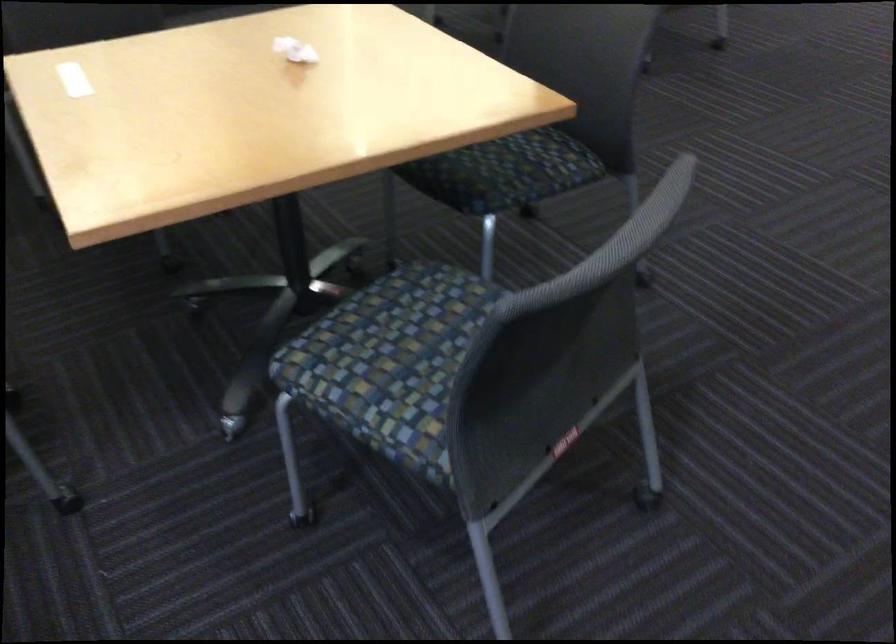
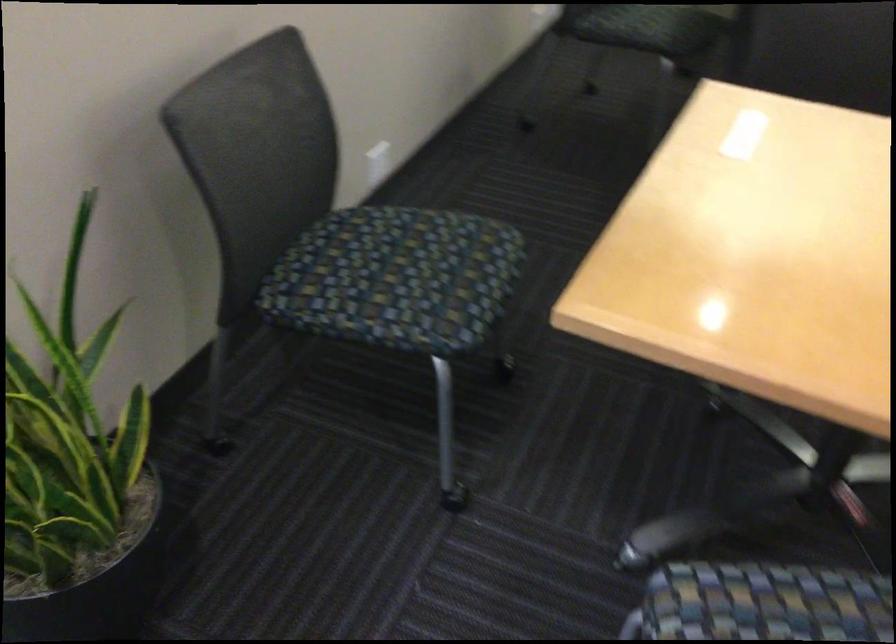
In the second image, find the point that corresponds to point 363,330 in the first image.

(765, 603)